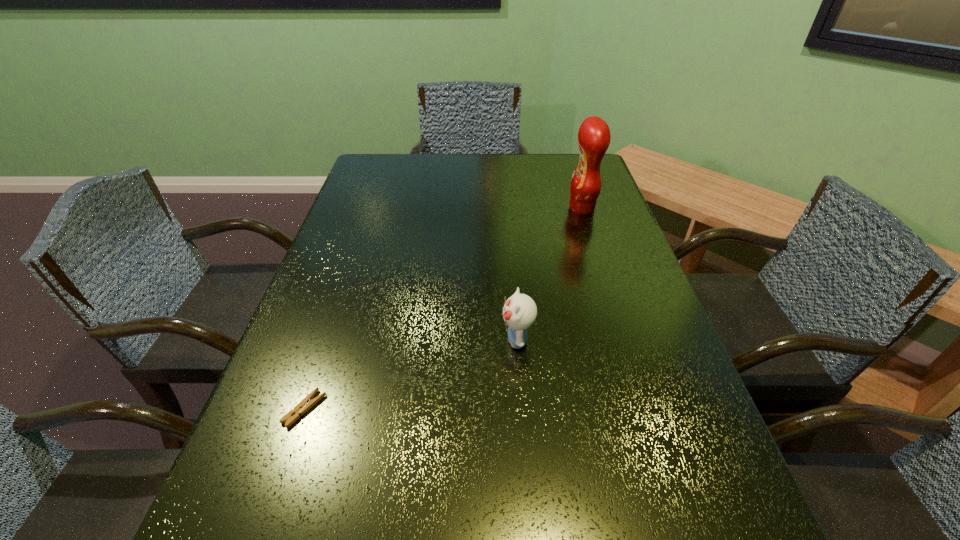
Where is `the farthest object`? The image size is (960, 540). the farthest object is located at coordinates (594, 137).

This screenshot has width=960, height=540. Find the location of `condiment`. condiment is located at coordinates (x=594, y=137).

Where is `the second nearest object`? The image size is (960, 540). the second nearest object is located at coordinates (519, 312).

Find the location of `the second object from right to left`. the second object from right to left is located at coordinates (519, 312).

Identify the location of clothespin. (292, 416).

In order to click on the nearest object in this screenshot , I will do `click(292, 416)`.

Find the location of `free space located on the label side of the rightmost object`. free space located on the label side of the rightmost object is located at coordinates (444, 208).

You are a GUI agent. You are given a task and a screenshot of the screen. Output one action in this format:
    pyautogui.click(x=<x>, y=<y>)
    Task: Click on the vacant area located on the label side of the rightmost object
    The height and width of the screenshot is (540, 960).
    Given the screenshot: What is the action you would take?
    pyautogui.click(x=513, y=208)

Locate an element on the screen. The height and width of the screenshot is (540, 960). free region located 0.370m on the label side of the rightmost object is located at coordinates (441, 208).

The height and width of the screenshot is (540, 960). I want to click on free region located on the front-facing side of the second object from left to right, so click(363, 339).